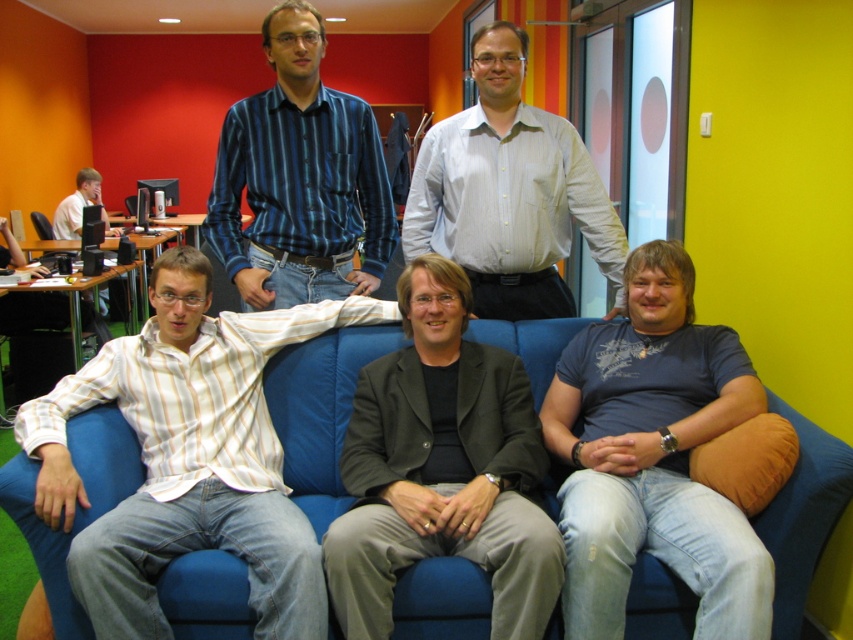
You are standing at the entrance of the office and want to approach the dark gray suit at center. According to the coordinates provided, in which direction should you move from your current position to reach it?

The dark gray suit at center is located at coordinates point (442, 468). Since the x and y values are both above 0.5, you should move towards the right and forward from the entrance to reach it.